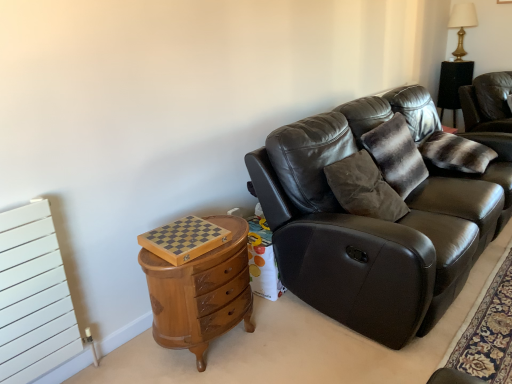
Question: Considering the positions of point (153, 269) and point (425, 147), is point (153, 269) closer or farther from the camera than point (425, 147)?

Choices:
 (A) farther
 (B) closer

Answer: (B)

Question: From a real-world perspective, is wooden chest of drawers at left positioned above or below striped fur pillow at upper right?

Choices:
 (A) above
 (B) below

Answer: (B)

Question: Which is nearer to the matte black leather couch at center?

Choices:
 (A) striped fur pillow at upper right
 (B) gold metallic table lamp at upper right
 (C) wooden chest of drawers at left
 (D) leather couch at right

Answer: (C)

Question: Which object is positioned farthest from the striped fur pillow at upper right?

Choices:
 (A) matte black leather couch at center
 (B) leather couch at right
 (C) gold metallic table lamp at upper right
 (D) wooden chest of drawers at left

Answer: (C)